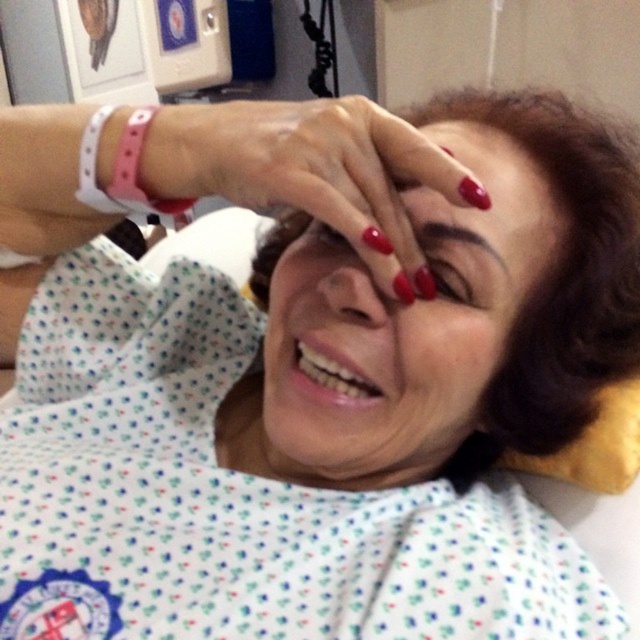
Where is the matte red nails at center located in the image?

The matte red nails at center are located at point [403,326] in the image.

In the scene shown: Based on the scene description, where exactly is the glossy red nails at center located in terms of coordinates?

The glossy red nails at center are located at the 2D coordinates point (317, 172).